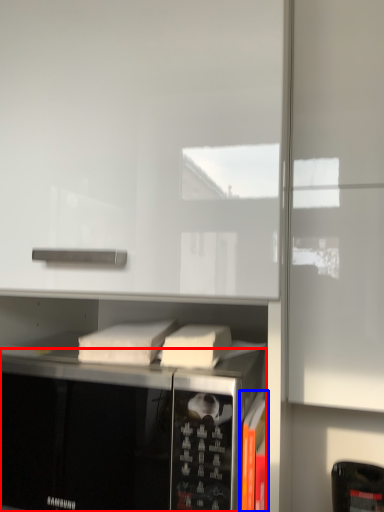
Question: Which object appears farthest to the camera in this image, microwave oven (highlighted by a red box) or book (highlighted by a blue box)?

Choices:
 (A) microwave oven
 (B) book

Answer: (B)